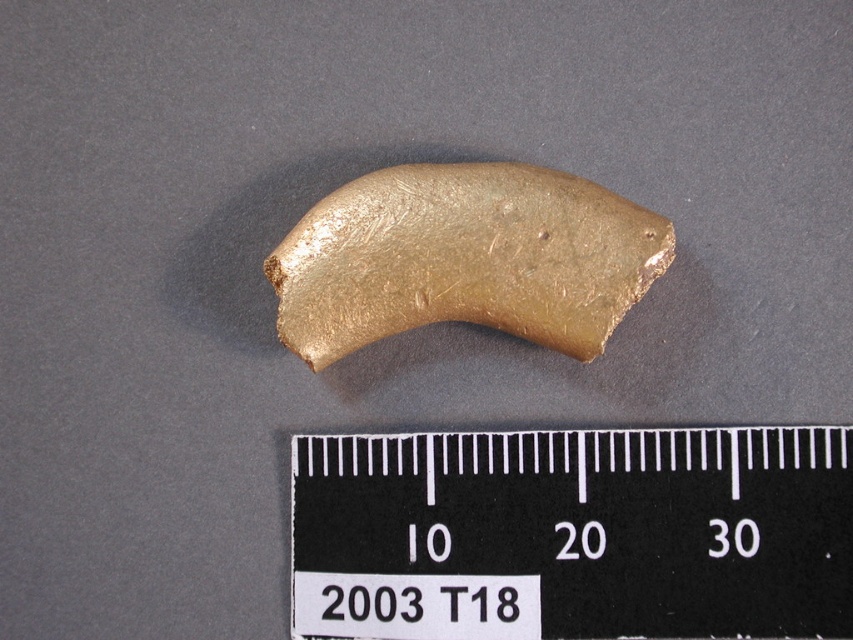
What object is located at the coordinates point (572, 534) in the image?

The point (572, 534) indicates the location of the black plastic ruler at center.

You are a photographer trying to capture a closeup of the black plastic ruler at center for a catalog. The catalog requires the ruler to be at least 5 feet away from the camera to avoid distortion. Based on the scene, is the current distance sufficient?

The distance between the black plastic ruler at center and the camera is 4.23 feet, which is less than the required 5 feet. Therefore, the current distance is insufficient to meet the catalog requirement.

You are an archaeologist examining the metallic fragment and the black plastic ruler at center. Based on their positions, can you determine if the ruler is directly below the fragment?

The black plastic ruler at center is positioned at point (572, 534), so it is directly below the metallic fragment.